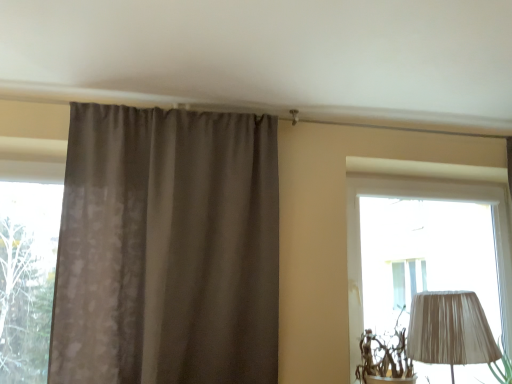
Question: From the image's perspective, relative to matte brown curtain at center, is transparent glass window at left above or below?

Choices:
 (A) below
 (B) above

Answer: (A)

Question: Is transparent glass window at left taller or shorter than matte brown curtain at center?

Choices:
 (A) short
 (B) tall

Answer: (A)

Question: Visually, is transparent glass window at left positioned to the left or to the right of matte brown curtain at center?

Choices:
 (A) left
 (B) right

Answer: (A)

Question: Relative to transparent glass window at left, is matte brown curtain at center in front or behind?

Choices:
 (A) front
 (B) behind

Answer: (A)

Question: Is matte brown curtain at center taller or shorter than transparent glass window at left?

Choices:
 (A) short
 (B) tall

Answer: (B)

Question: From a real-world perspective, is matte brown curtain at center positioned above or below transparent glass window at left?

Choices:
 (A) below
 (B) above

Answer: (B)

Question: Is matte brown curtain at center inside or outside of transparent glass window at left?

Choices:
 (A) inside
 (B) outside

Answer: (B)